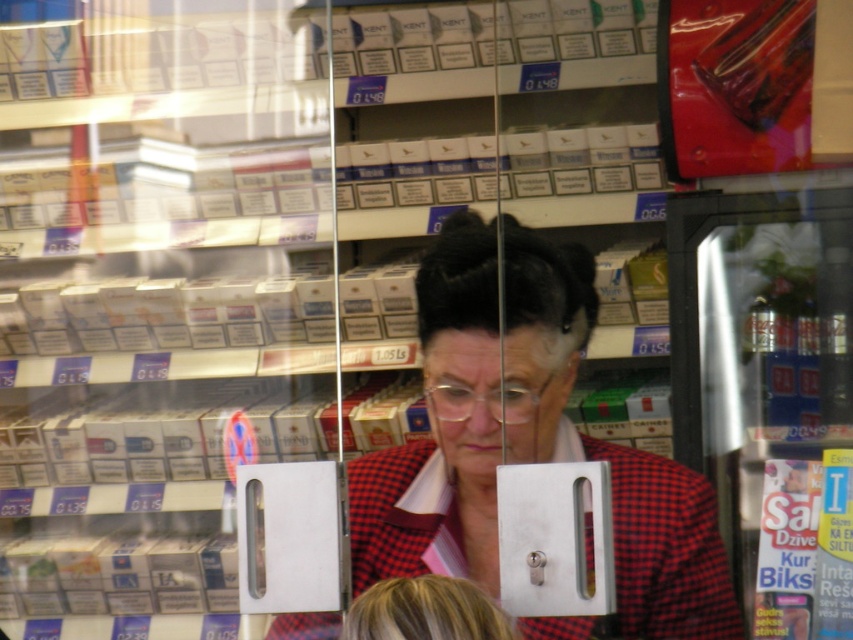
Question: Which point appears farthest from the camera in this image?

Choices:
 (A) (384, 616)
 (B) (611, 452)

Answer: (B)

Question: Is red plaid blazer at center to the left of blonde hair at lower center from the viewer's perspective?

Choices:
 (A) no
 (B) yes

Answer: (A)

Question: Is red plaid blazer at center to the left of blonde hair at lower center from the viewer's perspective?

Choices:
 (A) no
 (B) yes

Answer: (A)

Question: Is red plaid blazer at center positioned behind blonde hair at lower center?

Choices:
 (A) no
 (B) yes

Answer: (B)